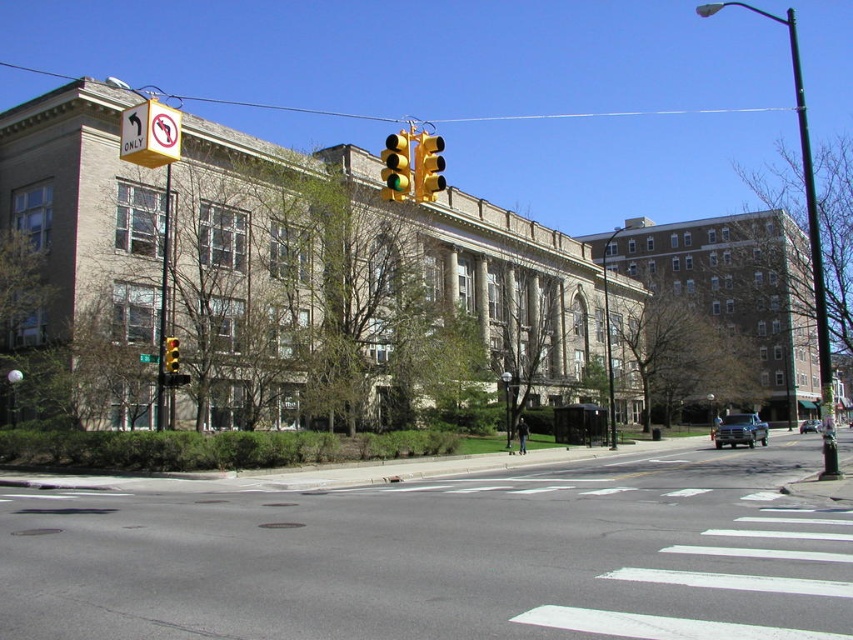
You are standing at the intersection and want to reach the green metallic pole at right. Based on the coordinates provided, in which direction should you walk from your current position to reach it?

The green metallic pole at right is located at coordinates point (x=814, y=262). Since the coordinate system typically has (x=0, y=0) at the bottom left corner, moving towards higher x values means going to the right and higher y values mean going upwards. Therefore, to reach the green metallic pole at right, you should walk diagonally towards the upper right direction from your current position.

You are a city planner analyzing the street layout. You need to determine which of the two traffic lights, the yellow plastic traffic light at upper center or the yellow glass traffic light at center, has a larger diameter. Based on the scene, which one would you choose?

The yellow glass traffic light at center has a larger diameter than the yellow plastic traffic light at upper center, so the yellow glass traffic light at center is the correct choice.

You are a pedestrian standing at the crosswalk and want to check both traffic lights. Which traffic light is closer to you, the yellow plastic traffic light at upper center or the yellow glass traffic light at center?

The yellow plastic traffic light at upper center is closer to you because it is further to the viewer than the yellow glass traffic light at center.